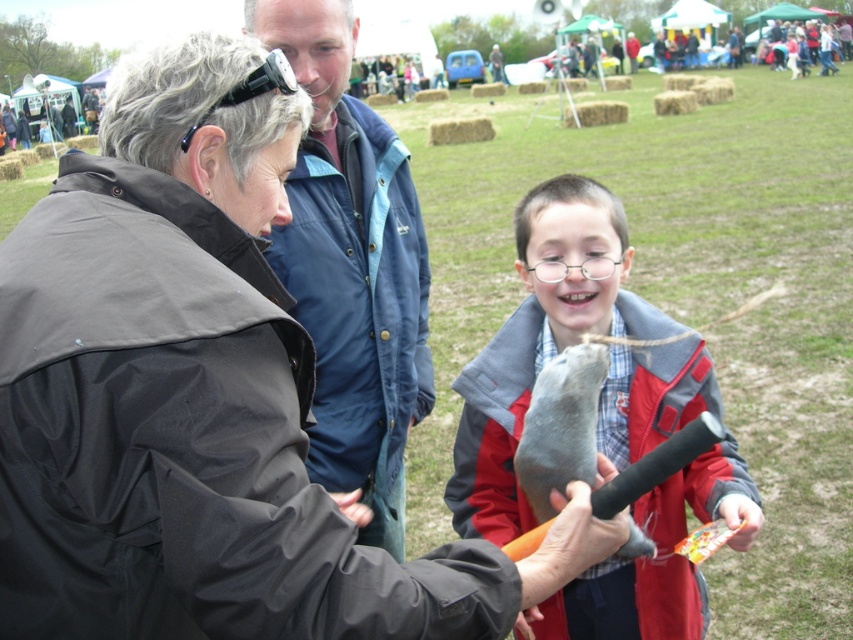
You are a photographer at the fair and want to capture both the matte black jacket at center and the blue fabric jacket at upper center in a single frame. Which jacket should you focus on first to ensure both are in the shot?

The matte black jacket at center is below the blue fabric jacket at upper center, so you should focus on the blue fabric jacket at upper center first to ensure both are within the frame.

You are a photographer trying to capture a group photo of the matte black jacket at center and the matte gray plush toy at center. If you want to ensure both subjects are fully visible in the frame, which one should you adjust your camera angle to focus on first?

The matte black jacket at center is shorter than the matte gray plush toy at center, so you should focus on the matte black jacket at center first to ensure it is fully visible in the frame.